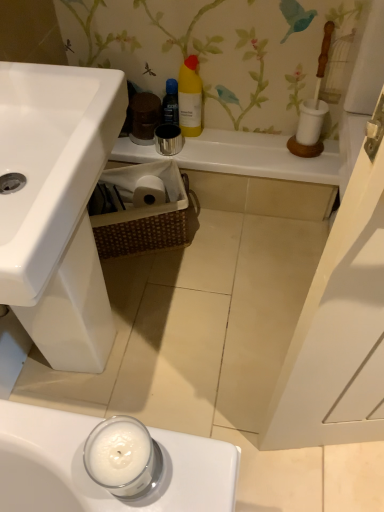
At what (x,y) coordinates should I click in order to perform the action: click on free space in front of black plastic spray can at upper center. Please return your answer as a coordinate pair (x, y). Looking at the image, I should click on (196, 150).